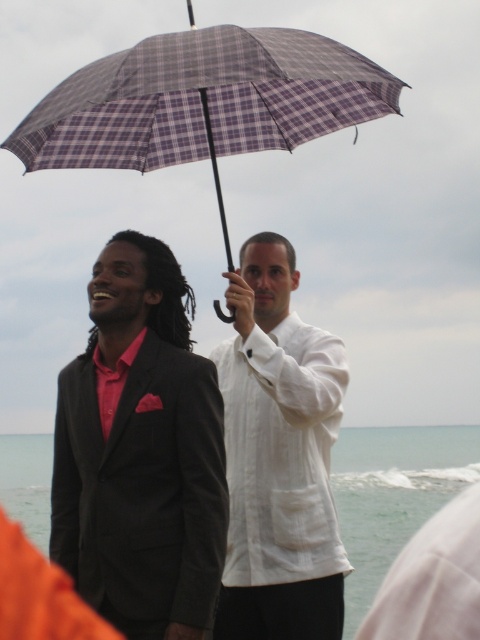
Is matte black suit at left further to camera compared to plaid fabric umbrella at center?

No, it is not.

Is matte black suit at left positioned before plaid fabric umbrella at center?

Yes, matte black suit at left is closer to the viewer.

What do you see at coordinates (141, 452) in the screenshot? I see `matte black suit at left` at bounding box center [141, 452].

At what (x,y) coordinates should I click in order to perform the action: click on matte black suit at left. Please return your answer as a coordinate pair (x, y). This screenshot has height=640, width=480. Looking at the image, I should click on (141, 452).

Who is taller, matte black suit at left or white linen shirt at center?

white linen shirt at center

Who is more forward, (211, 410) or (337, 577)?

Point (211, 410) is in front.

Describe the element at coordinates (141, 452) in the screenshot. The image size is (480, 640). I see `matte black suit at left` at that location.

This screenshot has width=480, height=640. Find the location of `matte black suit at left`. matte black suit at left is located at coordinates (141, 452).

Between point (231, 500) and point (207, 52), which one is positioned behind?

The point (231, 500) is behind.

Can you confirm if white linen shirt at center is bigger than plaid fabric umbrella at center?

Yes.

Is point (248, 273) positioned after point (267, 45)?

Yes, it is behind point (267, 45).

The height and width of the screenshot is (640, 480). I want to click on white linen shirt at center, so click(278, 458).